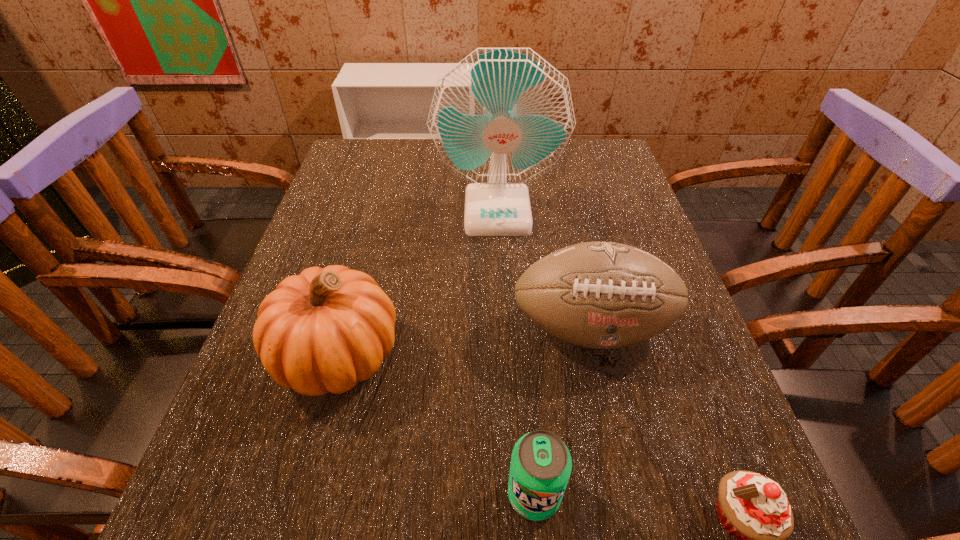
Where is `the tallest object`? The height and width of the screenshot is (540, 960). the tallest object is located at coordinates (500, 118).

Locate an element on the screen. The image size is (960, 540). the farthest object is located at coordinates (500, 118).

Find the location of a particular element. The width and height of the screenshot is (960, 540). pumpkin is located at coordinates (324, 330).

Locate an element on the screen. football (American) is located at coordinates (604, 295).

Where is `pop soda`? The image size is (960, 540). pop soda is located at coordinates (541, 464).

This screenshot has height=540, width=960. What are the coordinates of `free region located 0.400m in front of the tallest object to face the airflow` in the screenshot? It's located at (506, 389).

The height and width of the screenshot is (540, 960). I want to click on vacant space located on the back of the pumpkin, so click(357, 286).

Locate an element on the screen. free space located on the laces of the football (American) is located at coordinates (612, 417).

Locate an element on the screen. This screenshot has width=960, height=540. object that is at the near edge is located at coordinates (541, 464).

The image size is (960, 540). In order to click on object present at the left edge in this screenshot , I will do `click(324, 330)`.